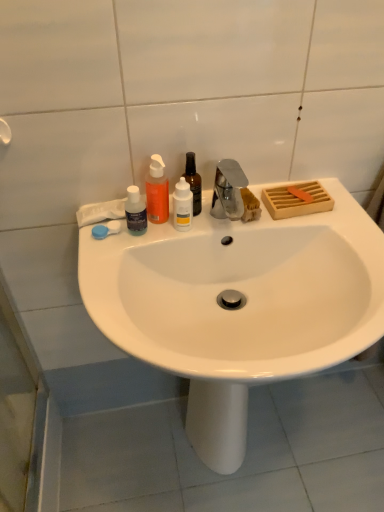
Locate an element on the screen. The height and width of the screenshot is (512, 384). free spot in front of translucent orange liquid at upper center, which is counted as the second bottle, starting from the left is located at coordinates (122, 262).